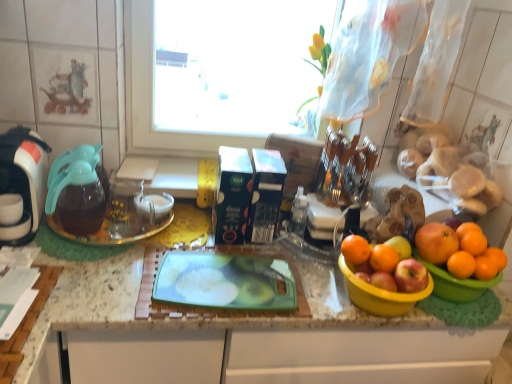
Question: Looking at their shapes, would you say orange matte at right, placed as the 2th orange when sorted from right to left, is wider or thinner than green plastic cutting board at center?

Choices:
 (A) wide
 (B) thin

Answer: (B)

Question: Is orange matte at right, arranged as the 5th orange when viewed from the left, taller or shorter than green plastic cutting board at center?

Choices:
 (A) tall
 (B) short

Answer: (B)

Question: Which object is the farthest from the orange matte at right, placed as the fourth orange when sorted from left to right?

Choices:
 (A) transparent glass plate at left
 (B) white glossy coffee maker at left
 (C) orange matte at right, which ranks as the 6th orange in left-to-right order
 (D) orange matte at right, the third orange in the left-to-right sequence
 (E) transparent glass coffeepot at left

Answer: (B)

Question: Which object is positioned closest to the white glossy coffee maker at left?

Choices:
 (A) orange matte at right, the 6th orange viewed from the right
 (B) orange matte at right, arranged as the 5th orange when viewed from the left
 (C) green plastic cutting board at center
 (D) transparent glass plate at left
 (E) yellow plastic bowl at right, which ranks as the 1th basin in right-to-left order

Answer: (D)